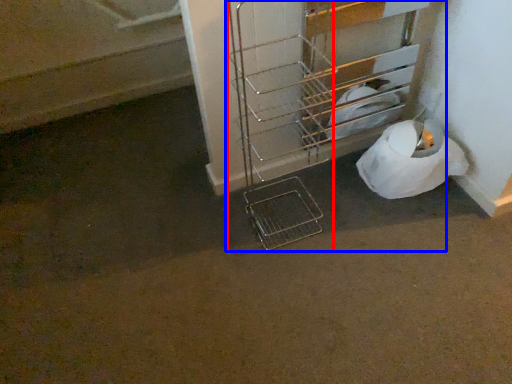
Question: Which point is further to the camera, trolley (highlighted by a red box) or trolley (highlighted by a blue box)?

Choices:
 (A) trolley
 (B) trolley

Answer: (B)